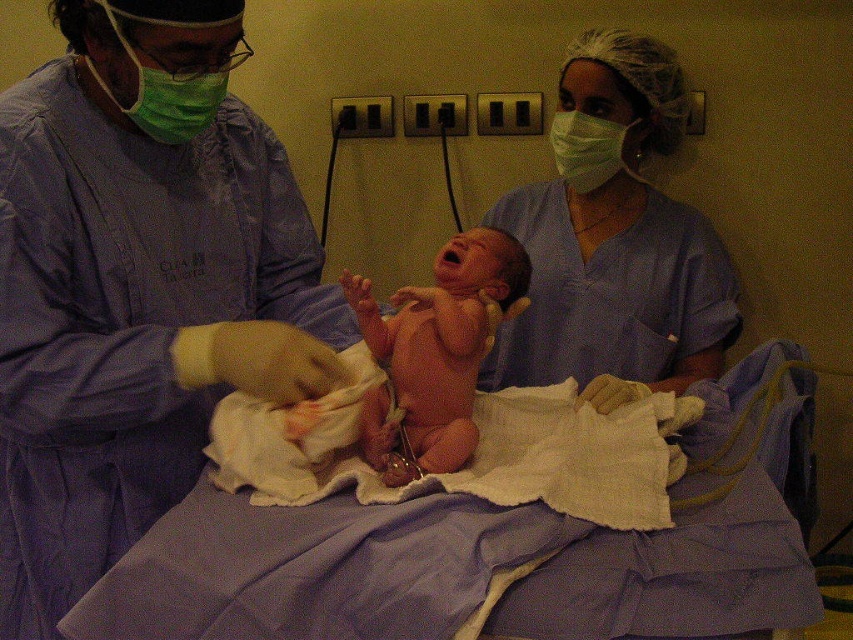
Question: Among these objects, which one is nearest to the camera?

Choices:
 (A) matte blue gown at center
 (B) green fabric mask at upper left
 (C) smooth skin newborn at center

Answer: (A)

Question: Is smooth skin newborn at center wider than green fabric mask at upper left?

Choices:
 (A) no
 (B) yes

Answer: (B)

Question: Which of the following is the farthest from the observer?

Choices:
 (A) 77,60
 (B) 666,241
 (C) 195,77

Answer: (B)

Question: Is green fabric mask at upper left to the right of green matte mask at upper center from the viewer's perspective?

Choices:
 (A) no
 (B) yes

Answer: (A)

Question: Which point is farther from the camera taking this photo?

Choices:
 (A) (579, 182)
 (B) (248, 109)
 (C) (734, 305)
 (D) (178, 115)

Answer: (C)

Question: Is smooth skin newborn at center above green fabric mask at upper left?

Choices:
 (A) yes
 (B) no

Answer: (B)